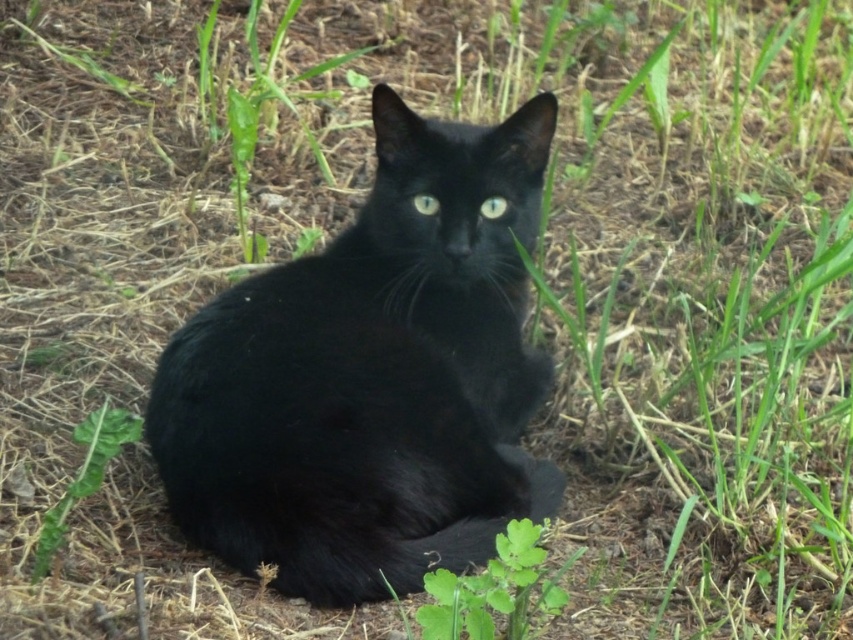
You are a photographer trying to capture the shiny black cat at center and the green leafy weed at lower left in the same frame. Based on their sizes, which one will appear bigger in the photo?

The shiny black cat at center will appear bigger in the photo because it is larger in size than the green leafy weed at lower left.

You are a photographer aiming to capture the black cat in the scene. You need to ensure that both the green leafy weed at lower left and the glossy white eye at center are visible in your shot. Given their sizes, which object will occupy more space in the photo?

The green leafy weed at lower left is bigger than the glossy white eye at center, so it will occupy more space in the photo.

You are a photographer trying to capture the black cat in the scene. The cat is currently at the coordinates point (x=370, y=378). Where should you position your camera to ensure the cat is centered in your shot?

The point (x=370, y=378) indicates the shiny black cat at center, so positioning the camera directly facing that coordinate will center the cat in the shot.